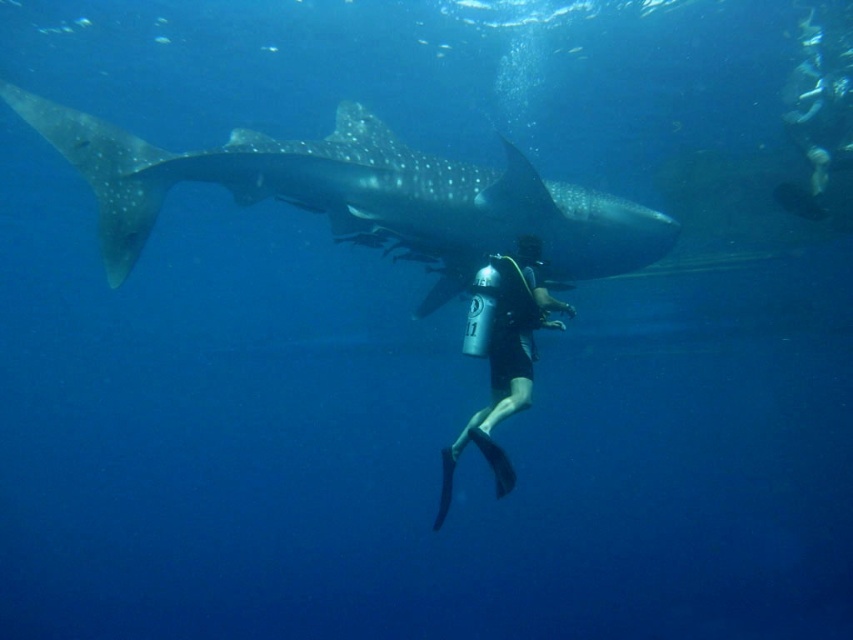
You are the black matte scuba diver at center in the underwater scene. You want to move to the right to avoid the speckled gray whale shark at upper center. Is the direction you want to move towards the right side of the image?

Yes, the speckled gray whale shark at upper center is to the left of the black matte scuba diver at center, so moving to the right would take you away from the shark and towards the right side of the image.

You are a marine biologist analyzing an underwater image. You notice a point labeled at coordinates (x=357, y=193). Based on the scene description, what marine creature is this point likely marking?

The point at coordinates (x=357, y=193) corresponds to the speckled gray whale shark at upper center.